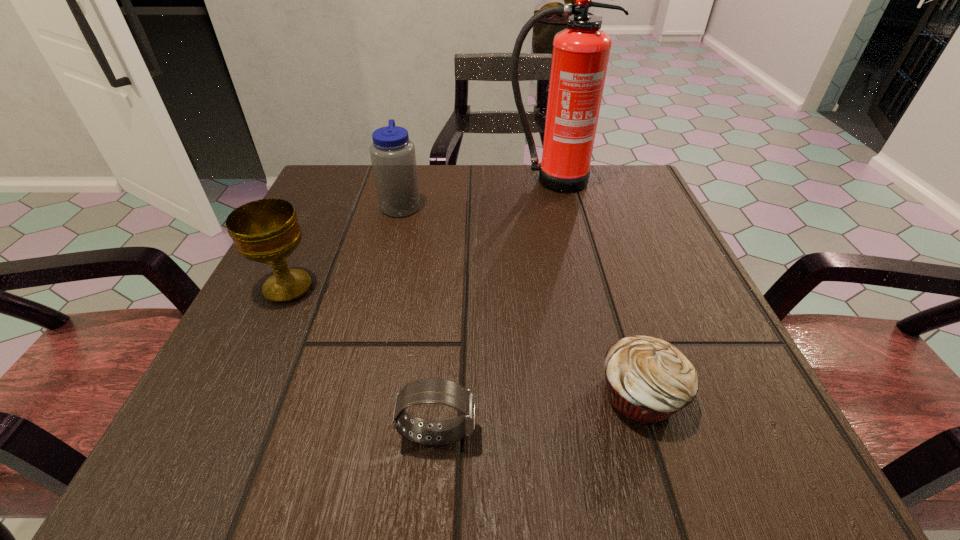
Where is `free location located on the left of the muffin`? free location located on the left of the muffin is located at coordinates (493, 395).

The width and height of the screenshot is (960, 540). What are the coordinates of `fire extinguisher that is positioned at the far edge` in the screenshot? It's located at (580, 55).

Identify the location of water bottle that is at the far edge. (393, 158).

You are a GUI agent. You are given a task and a screenshot of the screen. Output one action in this format:
    pyautogui.click(x=<x>, y=<y>)
    Task: Click on the watch located in the near edge section of the desktop
    
    Given the screenshot: What is the action you would take?
    pyautogui.click(x=440, y=391)

The image size is (960, 540). I want to click on muffin located at the near edge, so click(647, 379).

This screenshot has width=960, height=540. Identify the location of water bottle situated at the left edge. (393, 158).

Where is `chalice positioned at the left edge`? chalice positioned at the left edge is located at coordinates (267, 231).

Locate an element on the screen. This screenshot has width=960, height=540. fire extinguisher located at the right edge is located at coordinates (580, 55).

Identify the location of muffin that is positioned at the right edge. The width and height of the screenshot is (960, 540). (647, 379).

Locate an element on the screen. Image resolution: width=960 pixels, height=540 pixels. object that is at the far left corner is located at coordinates (393, 158).